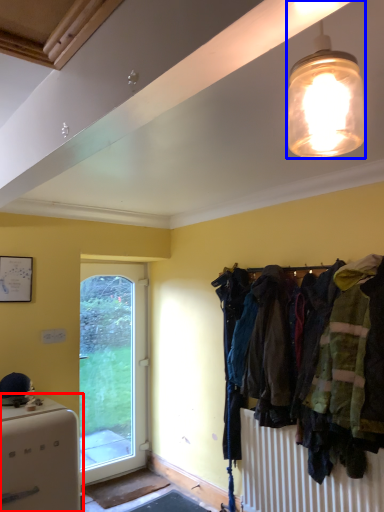
Question: Which of the following is the closest to the observer, appliance (highlighted by a red box) or lamp (highlighted by a blue box)?

Choices:
 (A) appliance
 (B) lamp

Answer: (B)